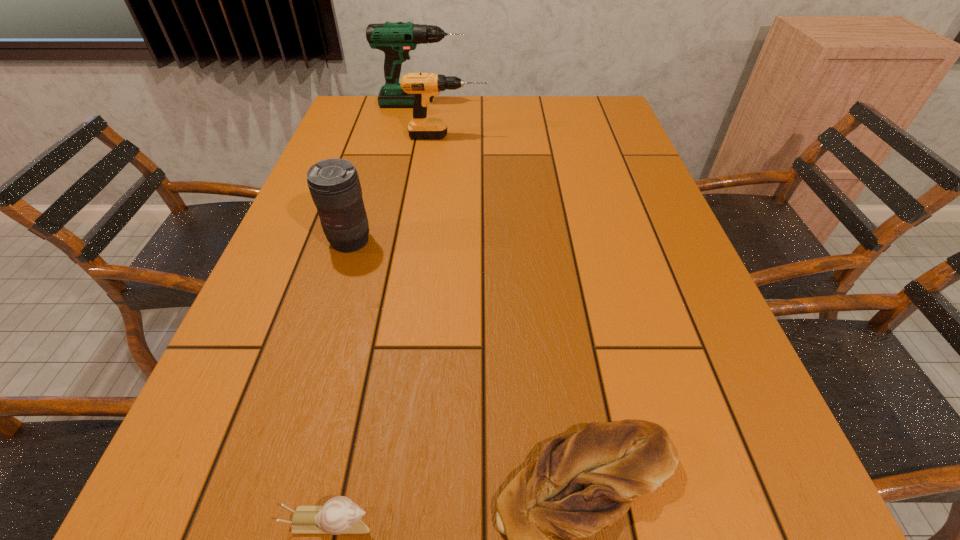
You are a GUI agent. You are given a task and a screenshot of the screen. Output one action in this format:
    pyautogui.click(x=<x>, y=<y>)
    Task: Click on the farthest object
    Image resolution: width=960 pixels, height=540 pixels.
    Given the screenshot: What is the action you would take?
    pyautogui.click(x=396, y=40)

The image size is (960, 540). Identify the location of the farther drill. (396, 40).

Find the location of a particular element. the nearer drill is located at coordinates (424, 86).

At what (x,y) coordinates should I click in order to perform the action: click on the fourth nearest object. Please return your answer as a coordinate pair (x, y). This screenshot has width=960, height=540. Looking at the image, I should click on (424, 86).

At what (x,y) coordinates should I click in order to perform the action: click on the third farthest object. Please return your answer as a coordinate pair (x, y). The height and width of the screenshot is (540, 960). Looking at the image, I should click on (334, 184).

Where is `vacant space located 0.070m on the handle side of the tallest object`? The height and width of the screenshot is (540, 960). vacant space located 0.070m on the handle side of the tallest object is located at coordinates (487, 105).

Where is `free point located at the tip of the nearer drill`? This screenshot has height=540, width=960. free point located at the tip of the nearer drill is located at coordinates (516, 137).

Identify the location of vacant space located 0.200m on the side of the telephoto lens where the control switches are located. (324, 328).

Image resolution: width=960 pixels, height=540 pixels. In order to click on object present at the far edge in this screenshot , I will do `click(396, 40)`.

Identify the location of drill that is positioned at the left edge. The image size is (960, 540). (396, 40).